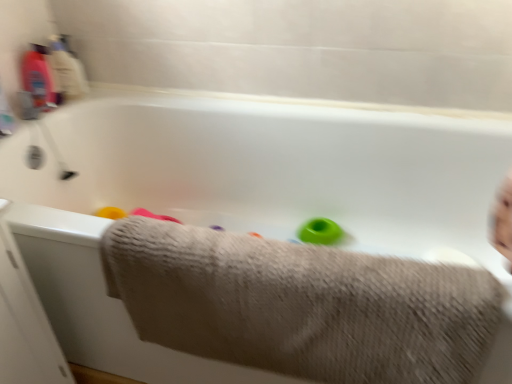
Identify the location of beige textured towel at lower center. (301, 305).

Can you tell me how much green rubber ring at center and translucent plastic bottle at upper left differ in facing direction?

The angular difference between green rubber ring at center and translucent plastic bottle at upper left is 84.4 degrees.

From the image's perspective, is green rubber ring at center below translucent plastic bottle at upper left?

Correct, green rubber ring at center appears lower than translucent plastic bottle at upper left in the image.

Find the location of a particular element. This screenshot has width=512, height=384. baby bottle above the green rubber ring at center (from the image's perspective) is located at coordinates (38, 78).

Could you tell me if green rubber ring at center is turned towards translucent plastic bottle at upper left?

No, green rubber ring at center is not aimed at translucent plastic bottle at upper left.

From the image's perspective, is beige textured towel at lower center above translucent plastic bottle at upper left?

No, from the image's perspective, beige textured towel at lower center is not on top of translucent plastic bottle at upper left.

Which object is positioned more to the right, beige textured towel at lower center or translucent plastic bottle at upper left?

Result: From the viewer's perspective, beige textured towel at lower center appears more on the right side.

Can you confirm if beige textured towel at lower center is thinner than translucent plastic bottle at upper left?

No.

Which object is closer to the camera, beige textured towel at lower center or translucent plastic bottle at upper left?

beige textured towel at lower center is closer to the camera.

Is point (38, 94) closer or farther from the camera than point (414, 289)?

Point (38, 94) is farther from the camera than point (414, 289).

From a real-world perspective, which is physically above, translucent plastic bottle at upper left or beige textured towel at lower center?

translucent plastic bottle at upper left, from a real-world perspective.

From the image's perspective, which is below, translucent plastic bottle at upper left or beige textured towel at lower center?

beige textured towel at lower center, from the image's perspective.

Consider the image. Is beige textured towel at lower center aimed at green rubber ring at center?

No, beige textured towel at lower center is not facing towards green rubber ring at center.

Considering the relative positions of beige textured towel at lower center and green rubber ring at center in the image provided, is beige textured towel at lower center behind green rubber ring at center?

No, it is in front of green rubber ring at center.

Locate an element on the screen. This screenshot has width=512, height=384. towel located in front of the green rubber ring at center is located at coordinates (301, 305).

Do you think beige textured towel at lower center is within green rubber ring at center, or outside of it?

beige textured towel at lower center cannot be found inside green rubber ring at center.

From a real-world perspective, which object rests below the other?

green rubber ring at center, from a real-world perspective.

Considering the positions of objects translucent plastic bottle at upper left and green rubber ring at center in the image provided, who is in front, translucent plastic bottle at upper left or green rubber ring at center?

translucent plastic bottle at upper left is in front.

Is point (41, 58) positioned after point (298, 230)?

No, it is in front of (298, 230).

Are translucent plastic bottle at upper left and green rubber ring at center far apart?

No, translucent plastic bottle at upper left is not far from green rubber ring at center.

Is green rubber ring at center bigger or smaller than beige textured towel at lower center?

In the image, green rubber ring at center appears to be smaller than beige textured towel at lower center.

Considering the sizes of objects green rubber ring at center and beige textured towel at lower center in the image provided, who is thinner, green rubber ring at center or beige textured towel at lower center?

With smaller width is green rubber ring at center.

Identify the location of toy behind the beige textured towel at lower center. The height and width of the screenshot is (384, 512). (320, 231).

From a real-world perspective, which object rests below the other?

green rubber ring at center.

I want to click on baby bottle above the green rubber ring at center (from the image's perspective), so click(38, 78).

Image resolution: width=512 pixels, height=384 pixels. What are the coordinates of `towel in front of the translucent plastic bottle at upper left` in the screenshot? It's located at (301, 305).

Which object lies further to the anchor point beige textured towel at lower center, green rubber ring at center or translucent plastic bottle at upper left?

The object further to beige textured towel at lower center is translucent plastic bottle at upper left.

Based on their spatial positions, is green rubber ring at center or beige textured towel at lower center further from translucent plastic bottle at upper left?

The object further to translucent plastic bottle at upper left is beige textured towel at lower center.

Estimate the real-world distances between objects in this image. Which object is further from beige textured towel at lower center, translucent plastic bottle at upper left or green rubber ring at center?

translucent plastic bottle at upper left is positioned further to the anchor beige textured towel at lower center.

From the image, which object appears to be nearer to green rubber ring at center, beige textured towel at lower center or translucent plastic bottle at upper left?

beige textured towel at lower center is closer to green rubber ring at center.

Which object lies further to the anchor point translucent plastic bottle at upper left, beige textured towel at lower center or green rubber ring at center?

The object further to translucent plastic bottle at upper left is beige textured towel at lower center.

In the scene shown: Estimate the real-world distances between objects in this image. Which object is closer to green rubber ring at center, translucent plastic bottle at upper left or beige textured towel at lower center?

Based on the image, beige textured towel at lower center appears to be nearer to green rubber ring at center.

You are a GUI agent. You are given a task and a screenshot of the screen. Output one action in this format:
    pyautogui.click(x=<x>, y=<y>)
    Task: Click on the towel between translucent plastic bottle at upper left and green rubber ring at center from left to right
    The image size is (512, 384).
    Given the screenshot: What is the action you would take?
    pyautogui.click(x=301, y=305)